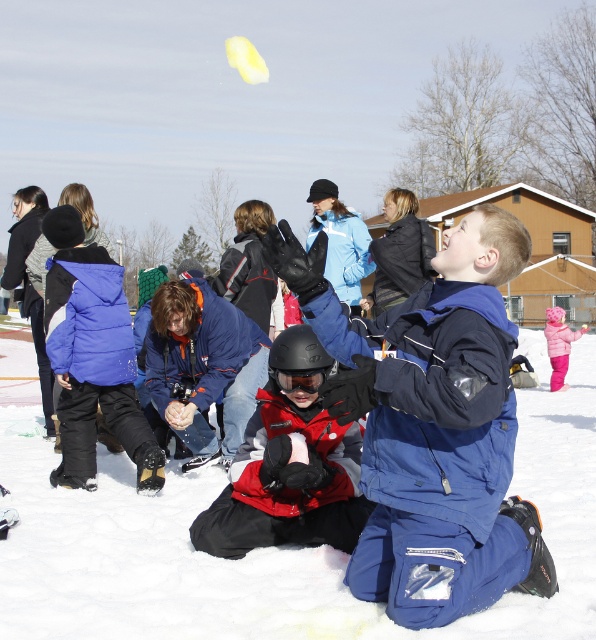
Which of these two, blue softshell jacket at center or red matte helmet at center, stands taller?

With more height is blue softshell jacket at center.

Is point (504, 476) farther from viewer compared to point (294, 499)?

No, it is in front of (294, 499).

Between point (437, 355) and point (280, 348), which one is positioned in front?

Positioned in front is point (437, 355).

Where is `blue softshell jacket at center`? This screenshot has width=596, height=640. blue softshell jacket at center is located at coordinates (433, 426).

Which is in front, point (92, 512) or point (318, 438)?

Positioned in front is point (318, 438).

Is white fluffy snow at center to the right of red matte helmet at center from the viewer's perspective?

Indeed, white fluffy snow at center is positioned on the right side of red matte helmet at center.

Where is `white fluffy snow at center`? white fluffy snow at center is located at coordinates (269, 547).

From the picture: Is the position of white fluffy snow at center less distant than that of blue softshell jacket at center?

No, it is not.

Find the location of a particular element. This screenshot has height=640, width=596. white fluffy snow at center is located at coordinates (269, 547).

At what (x,y) coordinates should I click in order to perform the action: click on white fluffy snow at center. Please return your answer as a coordinate pair (x, y). Image resolution: width=596 pixels, height=640 pixels. Looking at the image, I should click on (269, 547).

The height and width of the screenshot is (640, 596). Find the location of `white fluffy snow at center`. white fluffy snow at center is located at coordinates (269, 547).